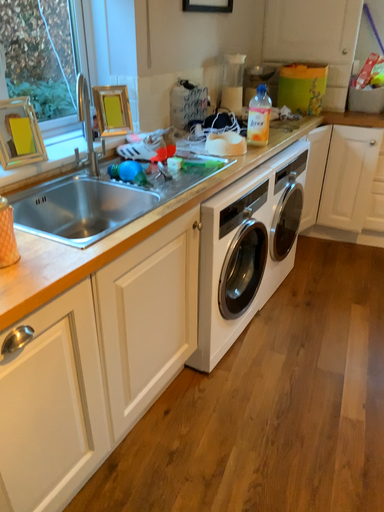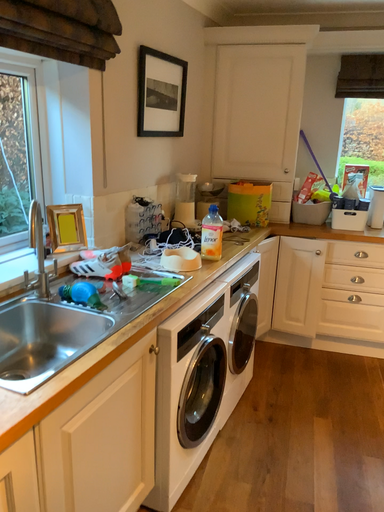
Question: Which way did the camera rotate in the video?

Choices:
 (A) rotated downward
 (B) rotated upward

Answer: (B)